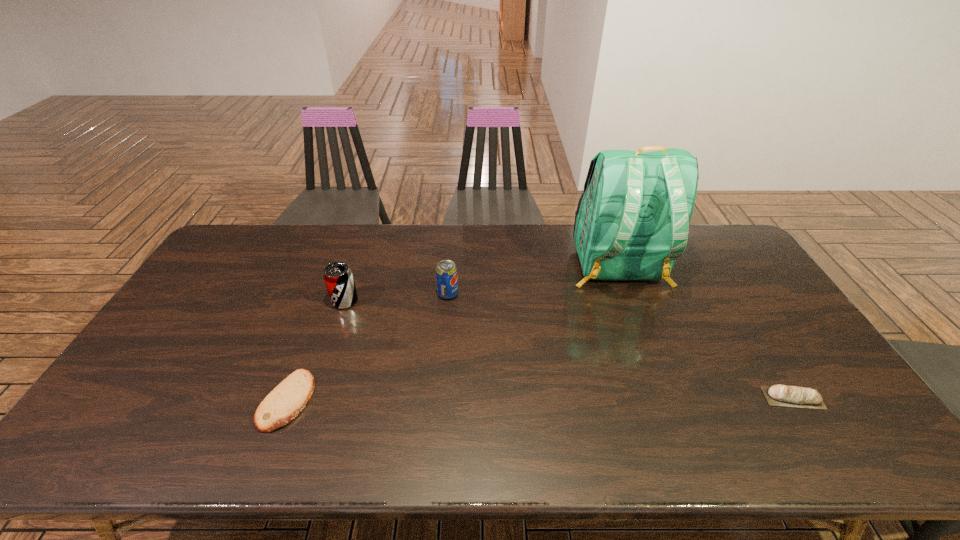
Identify the location of free space that is in between the left pita bread and the fourth object from left to right. Image resolution: width=960 pixels, height=540 pixels. (452, 333).

You are a GUI agent. You are given a task and a screenshot of the screen. Output one action in this format:
    pyautogui.click(x=<x>, y=<y>)
    Task: Click on the free space between the left pita bread and the right soda
    This screenshot has width=960, height=540.
    Given the screenshot: What is the action you would take?
    pyautogui.click(x=368, y=347)

Identify the location of free space between the right soda and the right pita bread. This screenshot has width=960, height=540. (620, 346).

Identify the location of vacant point located between the left pita bread and the backpack. This screenshot has height=540, width=960. (452, 333).

Locate an element on the screen. The width and height of the screenshot is (960, 540). free spot between the left soda and the left pita bread is located at coordinates (316, 350).

Identify the location of free space between the third object from right to left and the left pita bread. [368, 347].

The width and height of the screenshot is (960, 540). What are the coordinates of `free space that is in between the backpack and the rightmost object` in the screenshot? It's located at (706, 332).

You are a GUI agent. You are given a task and a screenshot of the screen. Output one action in this format:
    pyautogui.click(x=<x>, y=<y>)
    Task: Click on the empty space that is in between the right pita bread and the left soda
    The height and width of the screenshot is (540, 960).
    Given the screenshot: What is the action you would take?
    pyautogui.click(x=569, y=349)

Locate an element on the screen. The width and height of the screenshot is (960, 540). vacant point located between the tallest object and the third object from left to right is located at coordinates (533, 280).

Locate an element on the screen. The width and height of the screenshot is (960, 540). empty space that is in between the left pita bread and the backpack is located at coordinates (452, 333).